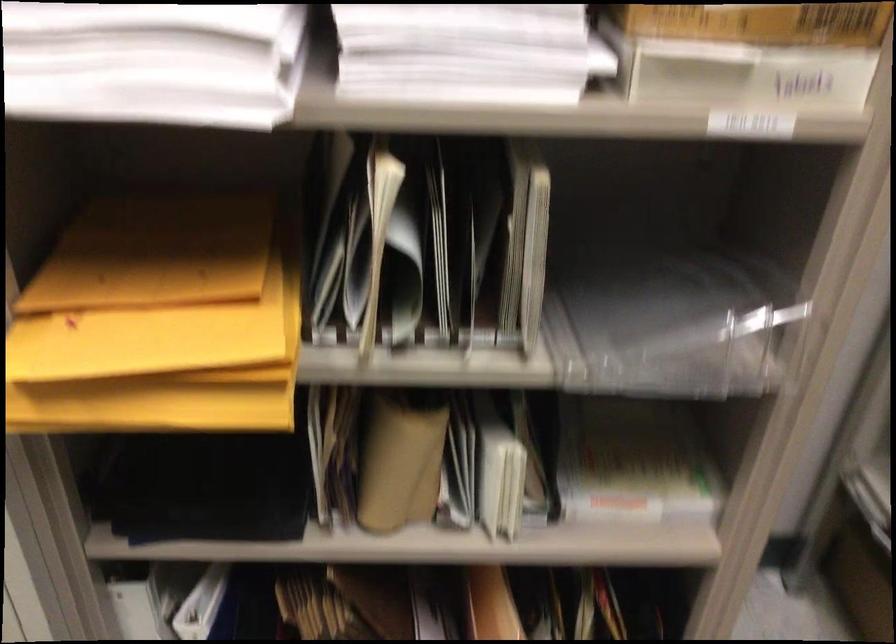
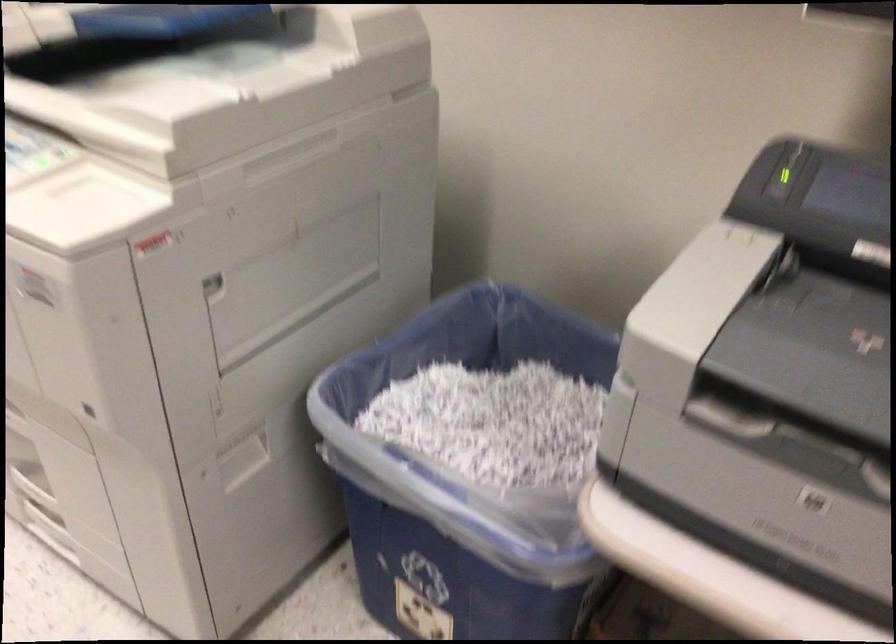
The first image is from the beginning of the video and the second image is from the end. How did the camera likely rotate when shooting the video?

The rotation direction of the camera is right-down.